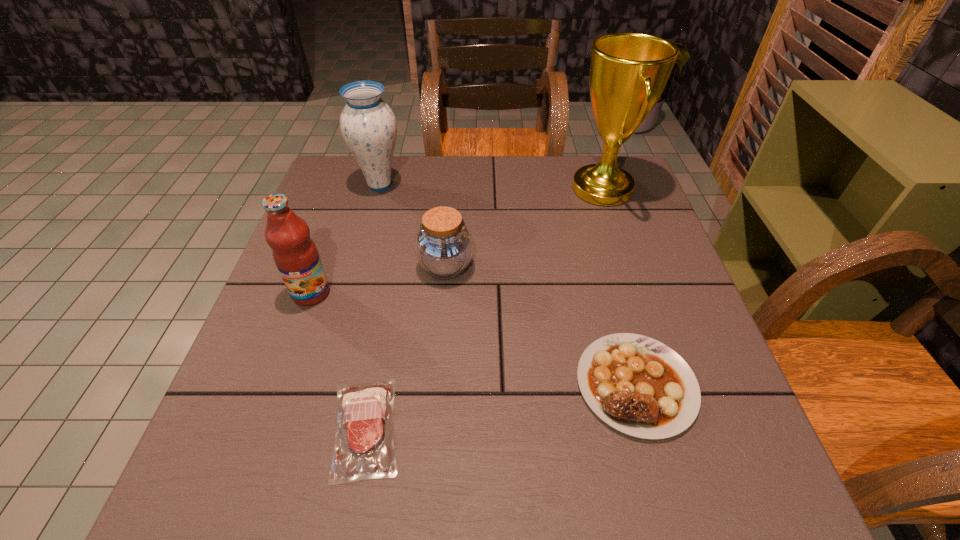
This screenshot has height=540, width=960. What are the coordinates of `the tallest object` in the screenshot? It's located at (628, 71).

Where is `vase`? This screenshot has height=540, width=960. vase is located at coordinates (368, 125).

Find the location of `fruit juice`. fruit juice is located at coordinates (295, 254).

You are a GUI agent. You are given a task and a screenshot of the screen. Output one action in this format:
    pyautogui.click(x=<x>, y=<y>)
    Task: Click on the jar
    
    Given the screenshot: What is the action you would take?
    pyautogui.click(x=444, y=246)

Locate an element on the screen. This screenshot has width=960, height=540. the second shortest object is located at coordinates 639,386.

Where is `the taller steak`? The width and height of the screenshot is (960, 540). the taller steak is located at coordinates (639, 386).

Locate an element on the screen. The height and width of the screenshot is (540, 960). the left steak is located at coordinates (364, 448).

Find the location of a particular element. The height and width of the screenshot is (540, 960). the shorter steak is located at coordinates (364, 448).

At what (x,y) coordinates should I click in order to perform the action: click on free region located 0.100m by the handles of the award. Please return your answer as a coordinate pair (x, y). Image resolution: width=960 pixels, height=540 pixels. Looking at the image, I should click on (533, 188).

Identify the location of free point located by the handles of the award. (551, 188).